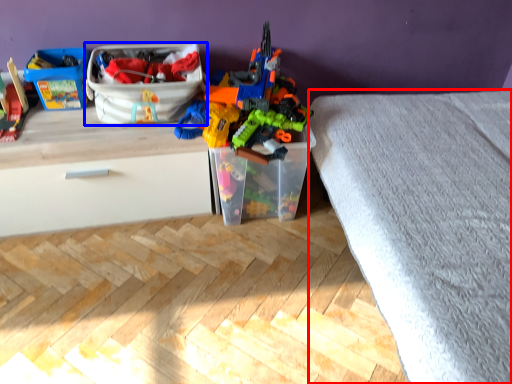
Question: Which of the following is the closest to the observer, bed frame (highlighted by a red box) or storage box (highlighted by a blue box)?

Choices:
 (A) bed frame
 (B) storage box

Answer: (A)